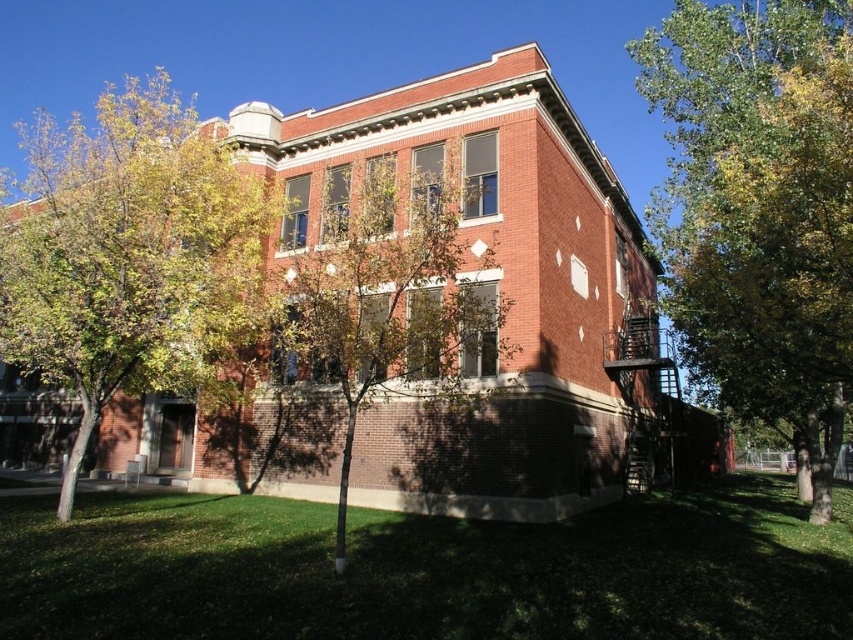
Is green leafy tree at lower left shorter than green leafy tree at center?

In fact, green leafy tree at lower left may be taller than green leafy tree at center.

Between point (109, 112) and point (383, 285), which one is positioned in front?

Positioned in front is point (109, 112).

At what (x,y) coordinates should I click in order to perform the action: click on green leafy tree at lower left. Please return your answer as a coordinate pair (x, y). The image size is (853, 640). Looking at the image, I should click on [132, 259].

Does green leafy tree at right have a smaller size compared to green leafy tree at center?

Actually, green leafy tree at right might be larger than green leafy tree at center.

What are the coordinates of `green leafy tree at right` in the screenshot? It's located at (759, 205).

Find the location of a particular element. green leafy tree at right is located at coordinates (759, 205).

Consider the image. Who is positioned more to the left, green leafy tree at right or green leafy tree at lower left?

green leafy tree at lower left is more to the left.

Is green leafy tree at right to the right of green leafy tree at lower left from the viewer's perspective?

Yes, green leafy tree at right is to the right of green leafy tree at lower left.

The image size is (853, 640). Find the location of `green leafy tree at right`. green leafy tree at right is located at coordinates (759, 205).